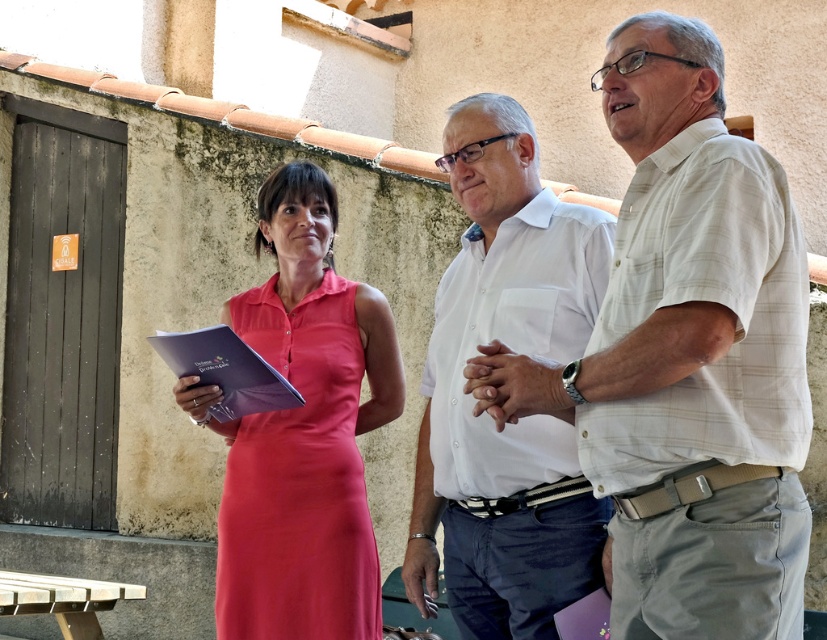
You are a photographer trying to capture a group photo of the three people in front of the rustic wall. You want to ensure that the person in the white plaid shirt at center and the person in the white cotton shirt at center are positioned correctly. Based on their current positions, which shirt is positioned to the right side of the other?

The white plaid shirt at center is positioned to the right of the white cotton shirt at center.

You are a photographer trying to capture a group photo of the white plaid shirt at center and the satin pink dress at center. To ensure both are centered in the frame, which direction should you move the camera slightly?

The white plaid shirt at center is positioned on the right side of the satin pink dress at center. To center both in the frame, move the camera slightly to the right so that the white plaid shirt at center and the satin pink dress at center are aligned centrally.